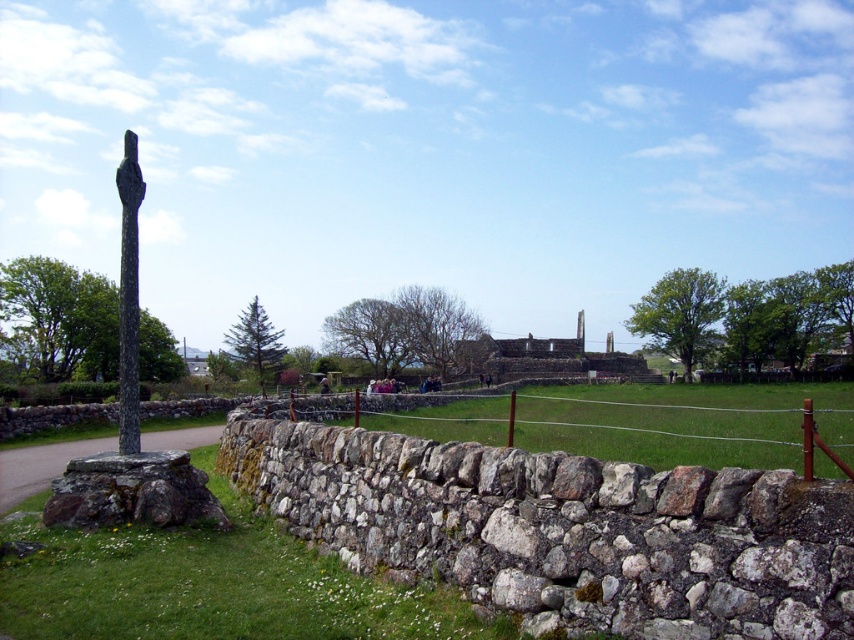
Is point (545, 566) closer to camera compared to point (316, 612)?

Yes.

Is natural stone wall at center further to the viewer compared to green grass at lower left?

No, it is not.

Is point (330, 467) closer to camera compared to point (189, 579)?

No, it is behind (189, 579).

Find the location of a particular element. natural stone wall at center is located at coordinates (563, 531).

Which is more to the right, green grass at lower left or dark gray stone pole at left?

green grass at lower left

Does green grass at lower left lie behind dark gray stone pole at left?

No.

At what (x,y) coordinates should I click in order to perform the action: click on green grass at lower left. Please return your answer as a coordinate pair (x, y). This screenshot has width=854, height=640. Looking at the image, I should click on (208, 586).

Is natural stone wall at center to the right of dark gray stone pole at left from the viewer's perspective?

Indeed, natural stone wall at center is positioned on the right side of dark gray stone pole at left.

Who is positioned more to the right, natural stone wall at center or dark gray stone pole at left?

From the viewer's perspective, natural stone wall at center appears more on the right side.

Where is `natural stone wall at center`? The width and height of the screenshot is (854, 640). natural stone wall at center is located at coordinates (563, 531).